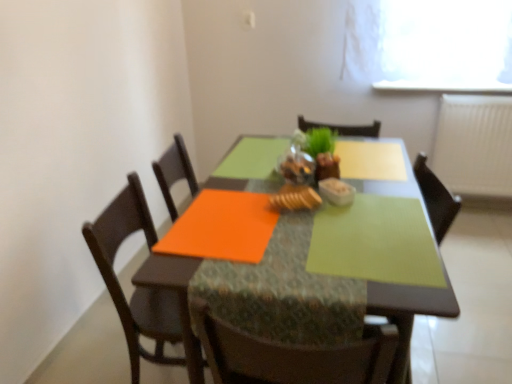
Locate an element on the screen. Image resolution: width=512 pixels, height=384 pixels. vacant area that is in front of baked golden bread at center is located at coordinates (294, 233).